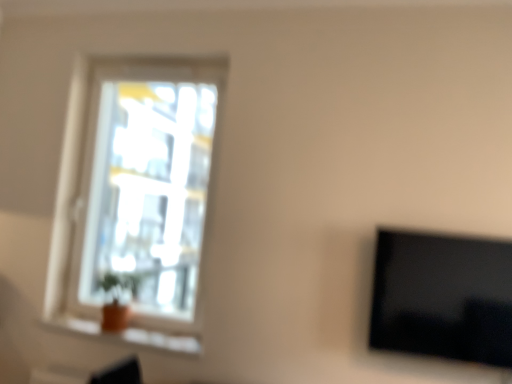
Question: From the image's perspective, is transparent glass window at upper left positioned above or below black glossy tv at right?

Choices:
 (A) above
 (B) below

Answer: (A)

Question: Considering the positions of transparent glass window at upper left and black glossy tv at right in the image, is transparent glass window at upper left taller or shorter than black glossy tv at right?

Choices:
 (A) tall
 (B) short

Answer: (A)

Question: Which object is the farthest from the black glossy tv at right?

Choices:
 (A) orange clay pot at lower left
 (B) transparent glass window at upper left

Answer: (B)

Question: Estimate the real-world distances between objects in this image. Which object is closer to the transparent glass window at upper left?

Choices:
 (A) orange clay pot at lower left
 (B) black glossy tv at right

Answer: (A)